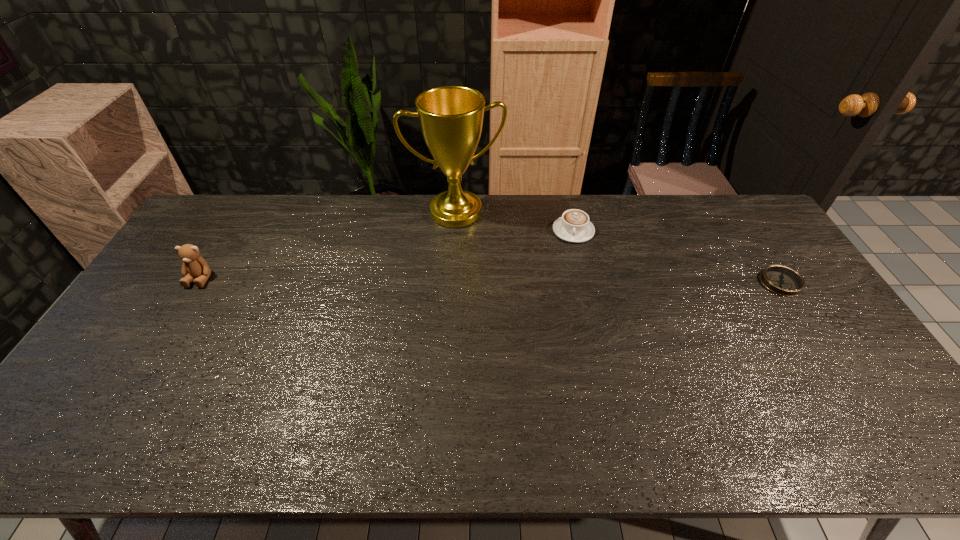
At what (x,y) coordinates should I click in order to perform the action: click on vacant space on the desktop that is between the third shortest object and the compass and is positioned with the handle on the right side of the third tallest object. Please return your answer as a coordinate pair (x, y). The image size is (960, 540). Looking at the image, I should click on (576, 281).

Identify the location of free space on the desktop that is between the leftmost object and the shortest object and is positioned by the handles of the second object from left to right. Image resolution: width=960 pixels, height=540 pixels. (474, 280).